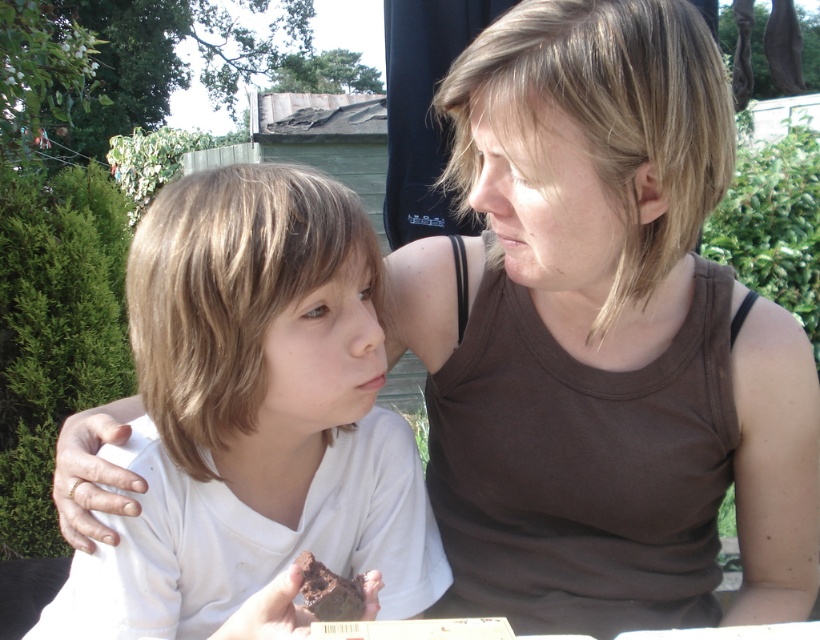
Between white matte shirt at left and light brown hair at center, which one has less height?

With less height is light brown hair at center.

Identify the location of white matte shirt at left. This screenshot has height=640, width=820. (254, 413).

What do you see at coordinates (607, 115) in the screenshot? I see `brown matte tank top at upper center` at bounding box center [607, 115].

Does point (595, 157) come farther from viewer compared to point (465, 122)?

That is False.

This screenshot has width=820, height=640. What do you see at coordinates (607, 115) in the screenshot?
I see `brown matte tank top at upper center` at bounding box center [607, 115].

I want to click on brown matte tank top at upper center, so click(607, 115).

Which is behind, point (213, 417) or point (515, 140)?

Point (213, 417)

From the picture: Between white matte shirt at left and light brown hair at upper center, which one is positioned lower?

white matte shirt at left

Is point (176, 410) positioned after point (522, 145)?

Yes, it is behind point (522, 145).

Where is `white matte shirt at left`? white matte shirt at left is located at coordinates (254, 413).